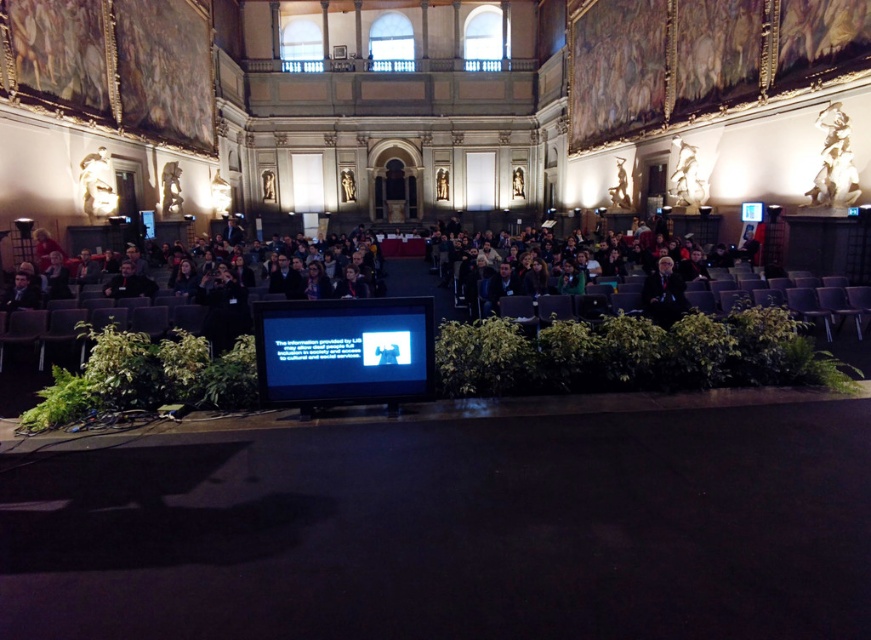
In the scene shown: Can you confirm if matte black screen at center is taller than dark blue suit at center?

In fact, matte black screen at center may be shorter than dark blue suit at center.

Is point (429, 365) less distant than point (674, 288)?

Yes, point (429, 365) is closer to viewer.

Find the location of a particular element. The width and height of the screenshot is (871, 640). matte black screen at center is located at coordinates (343, 349).